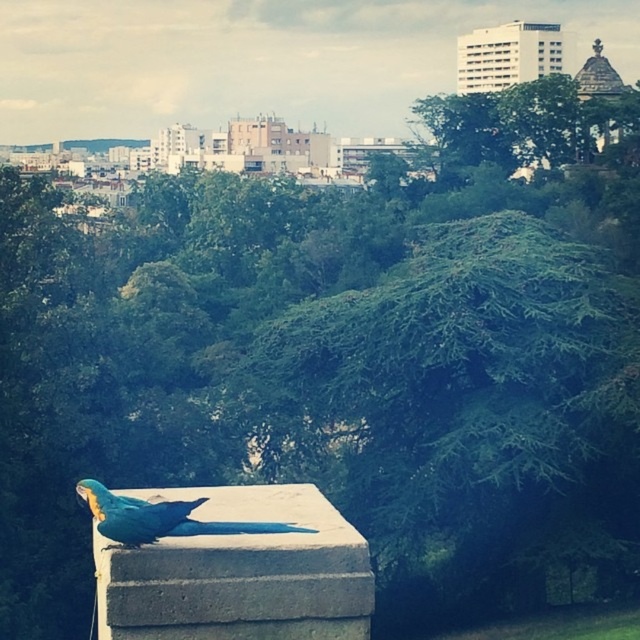
You are a birdwatcher trying to determine if the blue glossy parrot at center can comfortably perch on the blue concrete at center. Based on the scene, can it fit? Please explain your reasoning.

The blue concrete at center is thinner than the blue glossy parrot at center. Since the concrete is thinner than the parrot, it may not provide enough space for the parrot to perch comfortably. The parrot might have difficulty balancing or spreading its feet adequately on such a narrow surface.

You are a park visitor standing in front of the blue concrete at center and the blue glossy parrot at center. Which object is taller?

The blue concrete at center is taller than the blue glossy parrot at center.

You are a park maintenance worker who needs to place a 16 inch measuring tape between the blue concrete at center and the blue glossy parrot at center. Will the measuring tape be long enough to reach both ends?

The blue concrete at center and blue glossy parrot at center are 16.19 inches apart. Since the measuring tape is 16 inches long, it is slightly shorter than the distance between them. Therefore, the measuring tape will not be long enough to reach both ends.